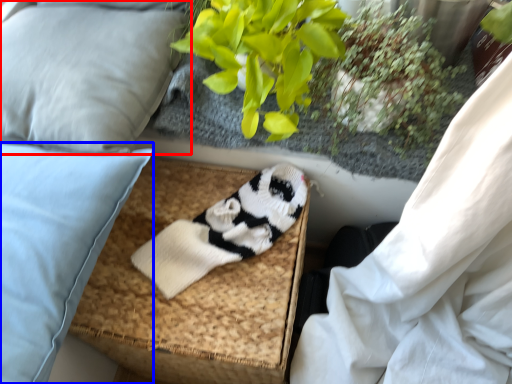
Question: Which object appears closest to the camera in this image, pillow (highlighted by a red box) or pillow (highlighted by a blue box)?

Choices:
 (A) pillow
 (B) pillow

Answer: (B)